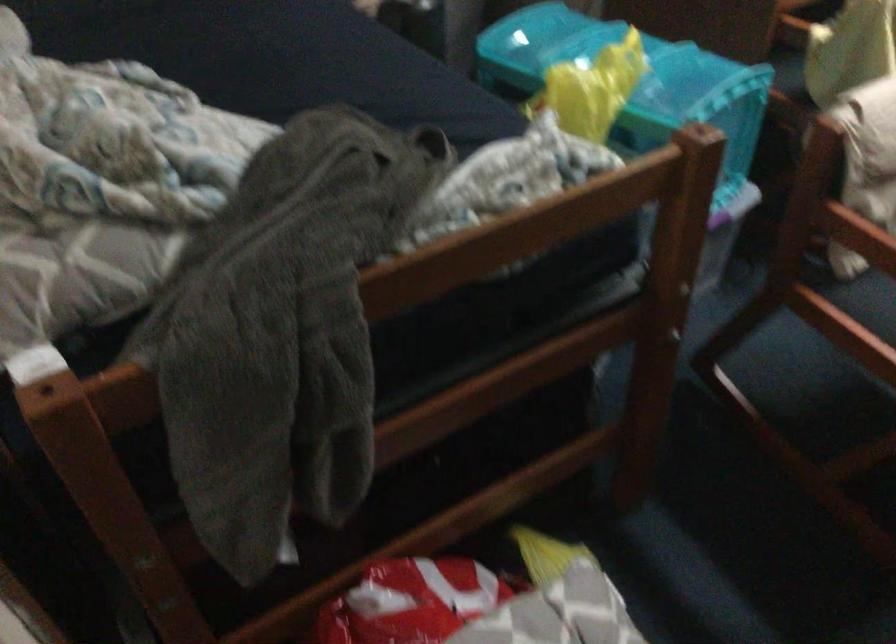
Which object does [600,62] point to?

It refers to a blue plastic container.